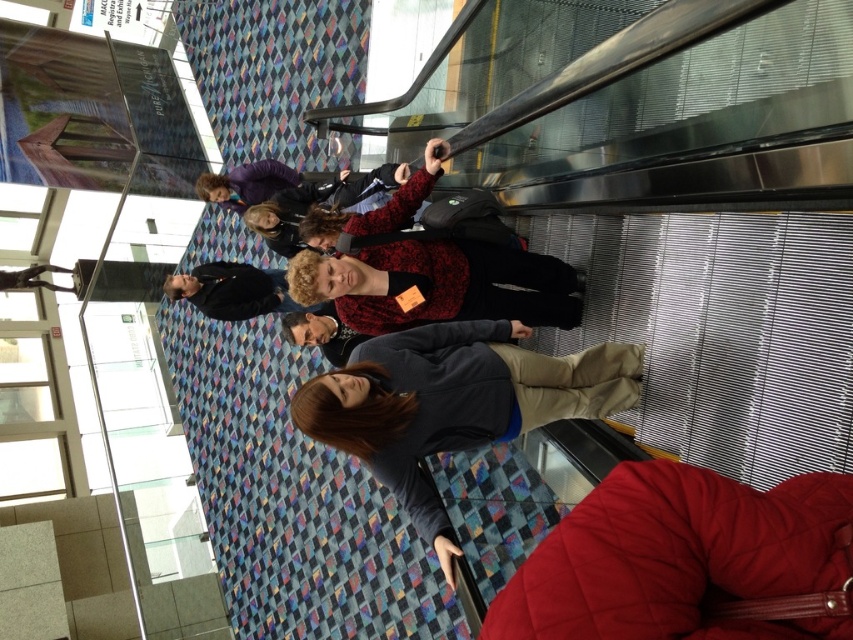
Question: Which object is the farthest from the metal statue at left?

Choices:
 (A) matte red sweater at center
 (B) black jacket at center
 (C) matte black jacket at upper center
 (D) red quilted jacket at lower right

Answer: (D)

Question: Does dark gray fleece jacket at center come in front of metal statue at left?

Choices:
 (A) no
 (B) yes

Answer: (B)

Question: Does red quilted jacket at lower right come behind black jacket at center?

Choices:
 (A) yes
 (B) no

Answer: (B)

Question: Which object is positioned closest to the matte red sweater at center?

Choices:
 (A) red quilted jacket at lower right
 (B) metal statue at left

Answer: (A)

Question: Where is dark gray fleece jacket at center located in relation to matte red sweater at center in the image?

Choices:
 (A) below
 (B) above

Answer: (A)

Question: Which object appears farthest from the camera in this image?

Choices:
 (A) matte black jacket at upper center
 (B) dark gray fleece jacket at center
 (C) red quilted jacket at lower right

Answer: (A)